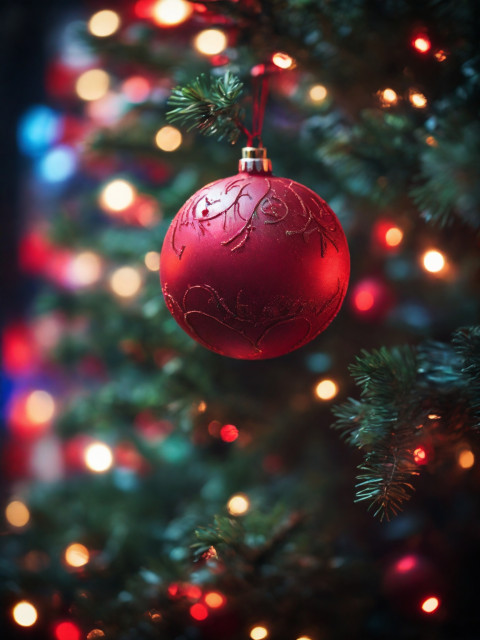
You are a GUI agent. You are given a task and a screenshot of the screen. Output one action in this format:
    pyautogui.click(x=<x>, y=<y>)
    Task: Click on the yellow lights
    
    Given the screenshot: What is the action you would take?
    pyautogui.click(x=81, y=550), pyautogui.click(x=13, y=521)